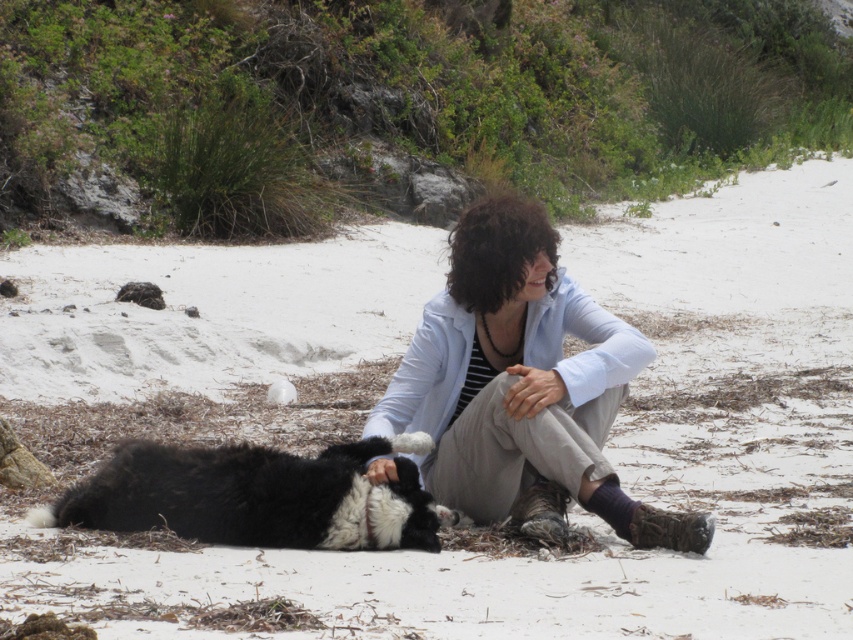
You are a photographer trying to capture a closeup of the light blue fabric jacket at center and the black fluffy dog at lower left. Which object should you focus on first if you want to ensure both are in focus without adjusting your camera settings?

The light blue fabric jacket at center has a greater height compared to the black fluffy dog at lower left, so focusing on the light blue fabric jacket at center first would ensure both are in focus since it is taller and likely farther away.

You are a photographer trying to capture the scene of the light blue fabric jacket at center and the black fluffy dog at lower left. Based on their positions, which object is higher up in the image?

The light blue fabric jacket at center is above the black fluffy dog at lower left, so it is higher up in the image.